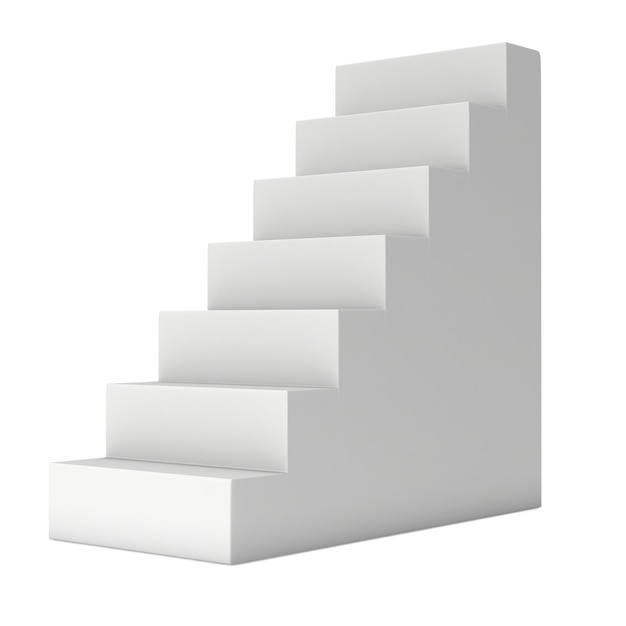
Find the location of `stairs`. stairs is located at coordinates (105, 496), (193, 426), (238, 362), (280, 275), (310, 198), (382, 136), (457, 62).